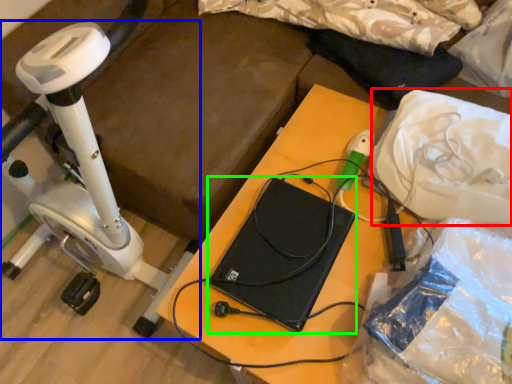
Question: Which object is positioned closest to material (highlighted by a red box)? Select from stationary bicycle (highlighted by a blue box) and computer (highlighted by a green box).

Choices:
 (A) stationary bicycle
 (B) computer

Answer: (B)